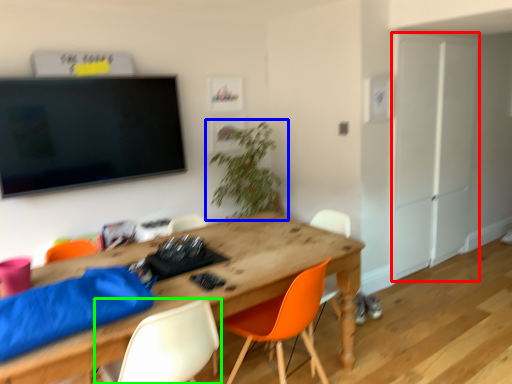
Question: Based on their relative distances, which object is farther from armoire (highlighted by a red box)? Choose from houseplant (highlighted by a blue box) and chair (highlighted by a green box).

Choices:
 (A) houseplant
 (B) chair

Answer: (B)